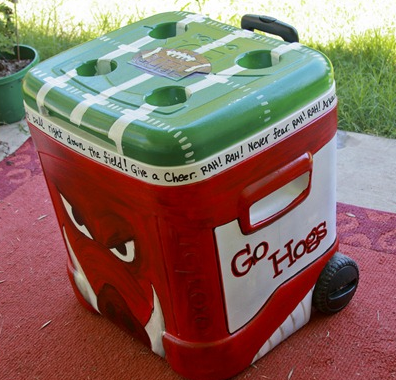
What are the coordinates of `field painting` in the screenshot? It's located at (201, 133).